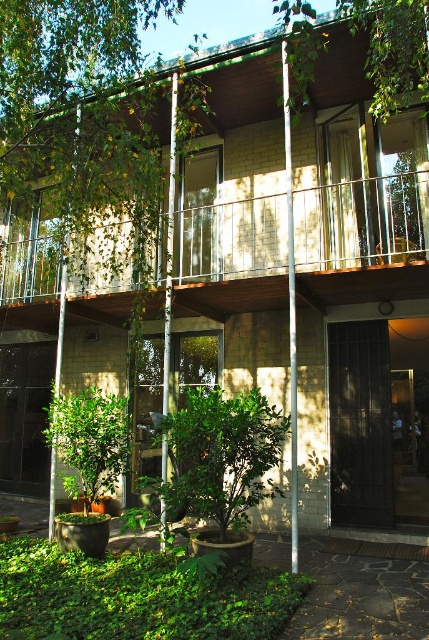
You are planning to install a new lighting fixture on the green wood balcony at upper center. Considering the height of the balcony and the green leafy tree at center, will the tree block the light from reaching the balcony?

The green wood balcony at upper center is shorter than the green leafy tree at center, so the tree may block some of the light from reaching the balcony.